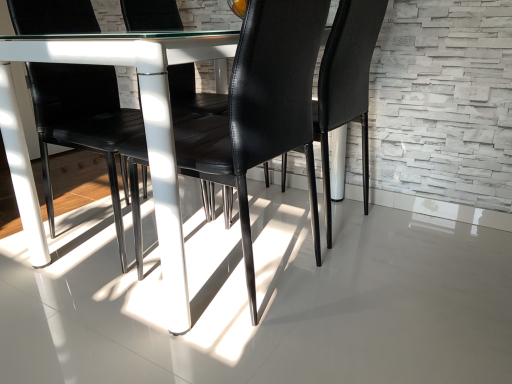
In order to click on white glossy concrete at center in this screenshot , I will do `click(275, 305)`.

This screenshot has width=512, height=384. What do you see at coordinates (275, 305) in the screenshot? I see `white glossy concrete at center` at bounding box center [275, 305].

Describe the element at coordinates (261, 110) in the screenshot. Image resolution: width=512 pixels, height=384 pixels. I see `black leather chair at center, marked as the first chair in a front-to-back arrangement` at that location.

What do you see at coordinates (346, 84) in the screenshot? The width and height of the screenshot is (512, 384). I see `black leather chair at center, arranged as the second chair when viewed from the front` at bounding box center [346, 84].

Find the location of a particular element. The height and width of the screenshot is (384, 512). white glossy concrete at center is located at coordinates (275, 305).

Is white glossy concrete at center inside or outside of black leather chair at center, arranged as the 2th chair when viewed from the back?

The correct answer is: outside.

Who is bigger, white glossy concrete at center or black leather chair at center, arranged as the 2th chair when viewed from the back?

black leather chair at center, arranged as the 2th chair when viewed from the back.

Between white glossy concrete at center and black leather chair at center, marked as the first chair in a front-to-back arrangement, which one appears on the left side from the viewer's perspective?

white glossy concrete at center is more to the left.

Is there a large distance between white glossy concrete at center and black leather chair at center, arranged as the 2th chair when viewed from the back?

Actually, white glossy concrete at center and black leather chair at center, arranged as the 2th chair when viewed from the back, are a little close together.

From a real-world perspective, is black leather chair at center, arranged as the 2th chair when viewed from the back, positioned above or below white glossy concrete at center?

black leather chair at center, arranged as the 2th chair when viewed from the back, is situated higher than white glossy concrete at center in the real world.

Is black leather chair at center, marked as the first chair in a front-to-back arrangement, closer to camera compared to white glossy concrete at center?

No, black leather chair at center, marked as the first chair in a front-to-back arrangement, is behind white glossy concrete at center.

From the image's perspective, which is above, black leather chair at center, marked as the first chair in a front-to-back arrangement, or white glossy concrete at center?

black leather chair at center, marked as the first chair in a front-to-back arrangement, from the image's perspective.

Can you confirm if black leather chair at center, arranged as the 2th chair when viewed from the back, is thinner than white glossy concrete at center?

Yes.

Can you confirm if black leather chair at center, arranged as the 2th chair when viewed from the back, is bigger than black leather chair at center, arranged as the second chair when viewed from the front?

Correct, black leather chair at center, arranged as the 2th chair when viewed from the back, is larger in size than black leather chair at center, arranged as the second chair when viewed from the front.

What's the angular difference between black leather chair at center, marked as the first chair in a front-to-back arrangement, and black leather chair at center, arranged as the second chair when viewed from the front,'s facing directions?

The angle between the facing direction of black leather chair at center, marked as the first chair in a front-to-back arrangement, and the facing direction of black leather chair at center, arranged as the second chair when viewed from the front, is 0.000241 degrees.

Considering the sizes of black leather chair at center, marked as the first chair in a front-to-back arrangement, and black leather chair at center, arranged as the second chair when viewed from the front, in the image, is black leather chair at center, marked as the first chair in a front-to-back arrangement, wider or thinner than black leather chair at center, arranged as the second chair when viewed from the front,?

In the image, black leather chair at center, marked as the first chair in a front-to-back arrangement, appears to be wider than black leather chair at center, arranged as the second chair when viewed from the front.

Is black leather chair at center, arranged as the 2th chair when viewed from the back, beside black leather chair at center, arranged as the second chair when viewed from the front?

No, black leather chair at center, arranged as the 2th chair when viewed from the back, is not with black leather chair at center, arranged as the second chair when viewed from the front.

Could you tell me if black leather chair at center, arranged as the first chair when viewed from the back, is facing black leather chair at center, arranged as the 2th chair when viewed from the back?

No, black leather chair at center, arranged as the first chair when viewed from the back, is not oriented towards black leather chair at center, arranged as the 2th chair when viewed from the back.

Considering the sizes of objects black leather chair at center, arranged as the second chair when viewed from the front, and black leather chair at center, arranged as the 2th chair when viewed from the back, in the image provided, who is thinner, black leather chair at center, arranged as the second chair when viewed from the front, or black leather chair at center, arranged as the 2th chair when viewed from the back,?

black leather chair at center, arranged as the second chair when viewed from the front.

Measure the distance from black leather chair at center, arranged as the second chair when viewed from the front, to black leather chair at center, marked as the first chair in a front-to-back arrangement.

black leather chair at center, arranged as the second chair when viewed from the front, and black leather chair at center, marked as the first chair in a front-to-back arrangement, are 17.83 inches apart.

From a real-world perspective, is black leather chair at center, arranged as the second chair when viewed from the front, over black leather chair at center, arranged as the 2th chair when viewed from the back?

Yes, from a real-world perspective, black leather chair at center, arranged as the second chair when viewed from the front, is on top of black leather chair at center, arranged as the 2th chair when viewed from the back.

Can you confirm if white glossy concrete at center is thinner than black leather chair at center, arranged as the first chair when viewed from the back?

In fact, white glossy concrete at center might be wider than black leather chair at center, arranged as the first chair when viewed from the back.

Is point (205, 378) behind point (332, 28)?

No.

From a real-world perspective, between white glossy concrete at center and black leather chair at center, arranged as the first chair when viewed from the back, who is vertically lower?

white glossy concrete at center, from a real-world perspective.

What's the angular difference between white glossy concrete at center and black leather chair at center, arranged as the second chair when viewed from the front,'s facing directions?

The angle between the facing direction of white glossy concrete at center and the facing direction of black leather chair at center, arranged as the second chair when viewed from the front, is 90.2 degrees.

From the image's perspective, is black leather chair at center, arranged as the first chair when viewed from the back, positioned above or below white glossy concrete at center?

Based on their image positions, black leather chair at center, arranged as the first chair when viewed from the back, is located above white glossy concrete at center.

Who is bigger, black leather chair at center, arranged as the first chair when viewed from the back, or white glossy concrete at center?

black leather chair at center, arranged as the first chair when viewed from the back, is bigger.

Is black leather chair at center, arranged as the first chair when viewed from the back, closer to camera compared to white glossy concrete at center?

No, the depth of black leather chair at center, arranged as the first chair when viewed from the back, is greater than that of white glossy concrete at center.

Which is correct: black leather chair at center, arranged as the first chair when viewed from the back, is inside white glossy concrete at center, or outside of it?

black leather chair at center, arranged as the first chair when viewed from the back, exists outside the volume of white glossy concrete at center.

Image resolution: width=512 pixels, height=384 pixels. In order to click on concrete in front of the black leather chair at center, marked as the first chair in a front-to-back arrangement in this screenshot , I will do `click(275, 305)`.

Locate an element on the screen. The height and width of the screenshot is (384, 512). chair that is the 1st one above the white glossy concrete at center (from a real-world perspective) is located at coordinates (261, 110).

When comparing their distances from white glossy concrete at center, does black leather chair at center, arranged as the first chair when viewed from the back, or black leather chair at center, marked as the first chair in a front-to-back arrangement, seem closer?

black leather chair at center, marked as the first chair in a front-to-back arrangement.

Considering their positions, is black leather chair at center, arranged as the first chair when viewed from the back, positioned further to black leather chair at center, marked as the first chair in a front-to-back arrangement, than white glossy concrete at center?

black leather chair at center, arranged as the first chair when viewed from the back, is positioned further to the anchor black leather chair at center, marked as the first chair in a front-to-back arrangement.

Looking at the image, which one is located further to black leather chair at center, arranged as the second chair when viewed from the front, black leather chair at center, marked as the first chair in a front-to-back arrangement, or white glossy concrete at center?

white glossy concrete at center lies further to black leather chair at center, arranged as the second chair when viewed from the front, than the other object.

Looking at this image, estimate the real-world distances between objects in this image. Which object is further from black leather chair at center, arranged as the first chair when viewed from the back, white glossy concrete at center or black leather chair at center, marked as the first chair in a front-to-back arrangement?

Based on the image, white glossy concrete at center appears to be further to black leather chair at center, arranged as the first chair when viewed from the back.

When comparing their distances from black leather chair at center, marked as the first chair in a front-to-back arrangement, does white glossy concrete at center or black leather chair at center, arranged as the first chair when viewed from the back, seem further?

The object further to black leather chair at center, marked as the first chair in a front-to-back arrangement, is black leather chair at center, arranged as the first chair when viewed from the back.

Based on the photo, estimate the real-world distances between objects in this image. Which object is further from white glossy concrete at center, black leather chair at center, marked as the first chair in a front-to-back arrangement, or black leather chair at center, arranged as the second chair when viewed from the front?

black leather chair at center, arranged as the second chair when viewed from the front, is further to white glossy concrete at center.

You are a GUI agent. You are given a task and a screenshot of the screen. Output one action in this format:
    pyautogui.click(x=<x>, y=<y>)
    Task: Click on the chair positioned between white glossy concrete at center and black leather chair at center, arranged as the second chair when viewed from the front, from near to far
    
    Given the screenshot: What is the action you would take?
    pyautogui.click(x=261, y=110)